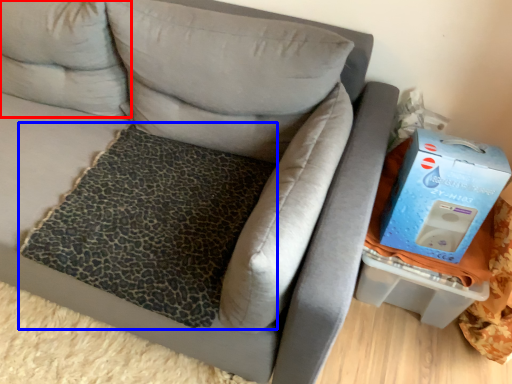
Question: Which of the following is the closest to the observer, pillow (highlighted by a red box) or mat (highlighted by a blue box)?

Choices:
 (A) pillow
 (B) mat

Answer: (B)